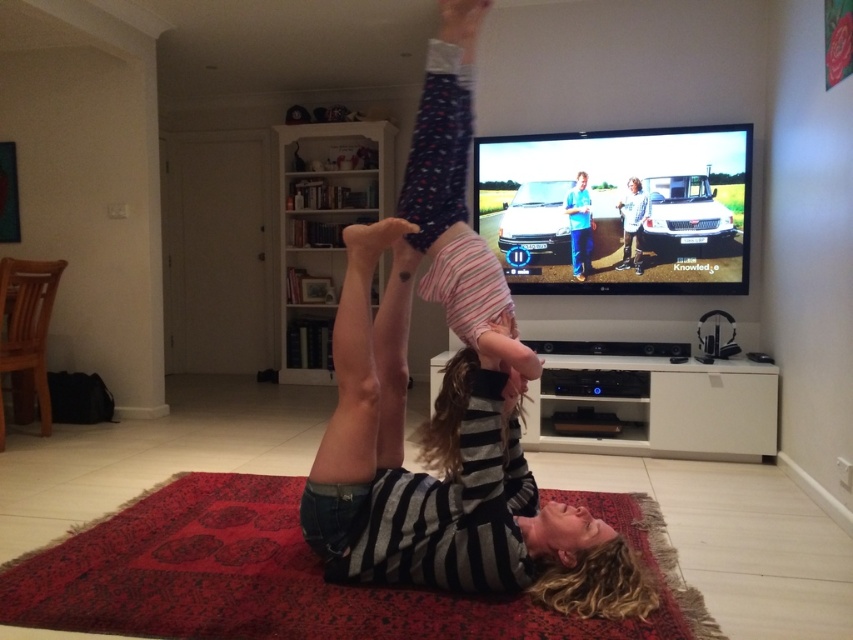
Between point (604, 577) and point (503, 362), which one is positioned in front?

Point (604, 577)

Is striped fabric person at center bigger than striped cotton shirt at center?

Yes, striped fabric person at center is bigger than striped cotton shirt at center.

Is point (540, 588) closer to viewer compared to point (433, 280)?

Yes, point (540, 588) is in front of point (433, 280).

Where is `striped fabric person at center`? striped fabric person at center is located at coordinates (444, 474).

Locate an element on the screen. red carpet at center is located at coordinates (293, 576).

Which is more to the right, red carpet at center or striped cotton shirt at center?

From the viewer's perspective, striped cotton shirt at center appears more on the right side.

This screenshot has width=853, height=640. I want to click on red carpet at center, so click(293, 576).

Is point (418, 128) behind point (637, 193)?

No.

Find the location of a particular element. The height and width of the screenshot is (640, 853). striped cotton shirt at center is located at coordinates (456, 195).

Is point (490, 296) behind point (639, 243)?

No, (490, 296) is closer to viewer.

You are a GUI agent. You are given a task and a screenshot of the screen. Output one action in this format:
    pyautogui.click(x=<x>, y=<y>)
    Task: Click on the striped cotton shirt at center
    The image size is (853, 640).
    Given the screenshot: What is the action you would take?
    pyautogui.click(x=456, y=195)